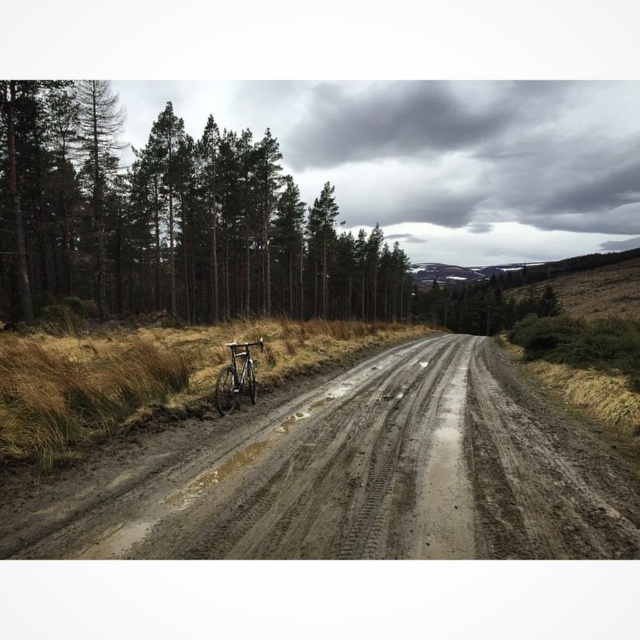
Question: Is green matte trees at left thinner than silver metallic bicycle at center?

Choices:
 (A) no
 (B) yes

Answer: (A)

Question: Can you confirm if green matte trees at left is wider than silver metallic bicycle at center?

Choices:
 (A) yes
 (B) no

Answer: (A)

Question: Which object is the farthest from the green matte trees at left?

Choices:
 (A) silver metallic bicycle at center
 (B) dull gray mud at left

Answer: (B)

Question: Does dull gray mud at left have a larger size compared to silver metallic bicycle at center?

Choices:
 (A) yes
 (B) no

Answer: (A)

Question: Which object appears closest to the camera in this image?

Choices:
 (A) dull gray mud at left
 (B) silver metallic bicycle at center

Answer: (A)

Question: Considering the real-world distances, which object is farthest from the dull gray mud at left?

Choices:
 (A) silver metallic bicycle at center
 (B) green matte trees at left

Answer: (B)